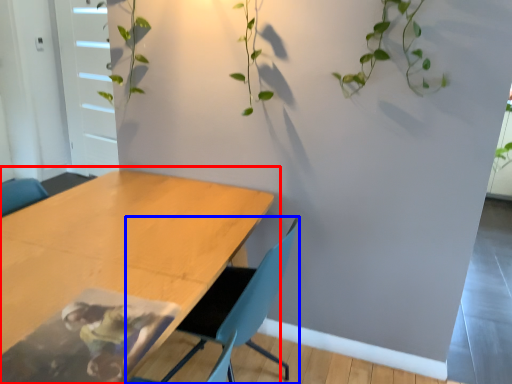
Question: Which point is further to the camera, table (highlighted by a red box) or chair (highlighted by a blue box)?

Choices:
 (A) table
 (B) chair

Answer: (B)